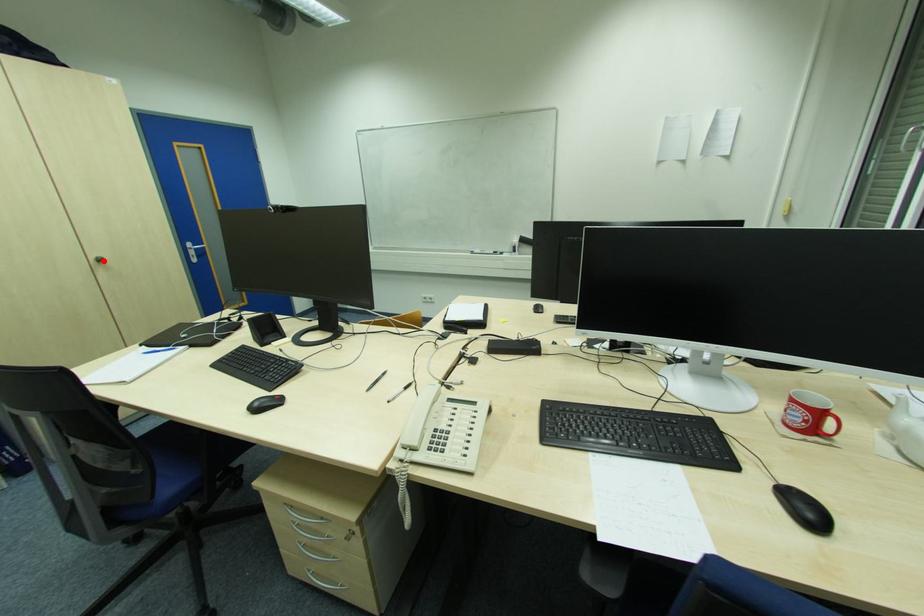
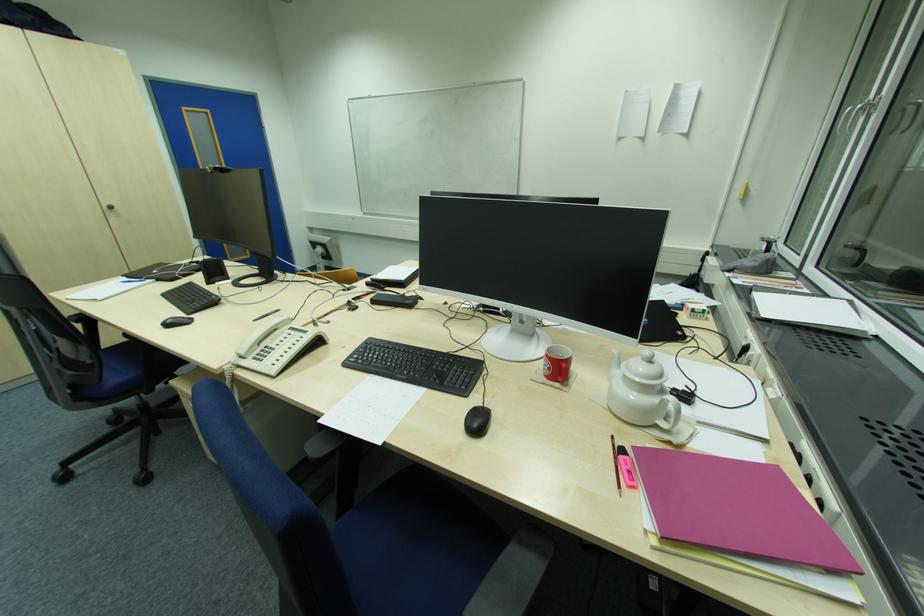
The point at the highlighted location is marked in the first image. Where is the corresponding point in the second image?

(114, 209)